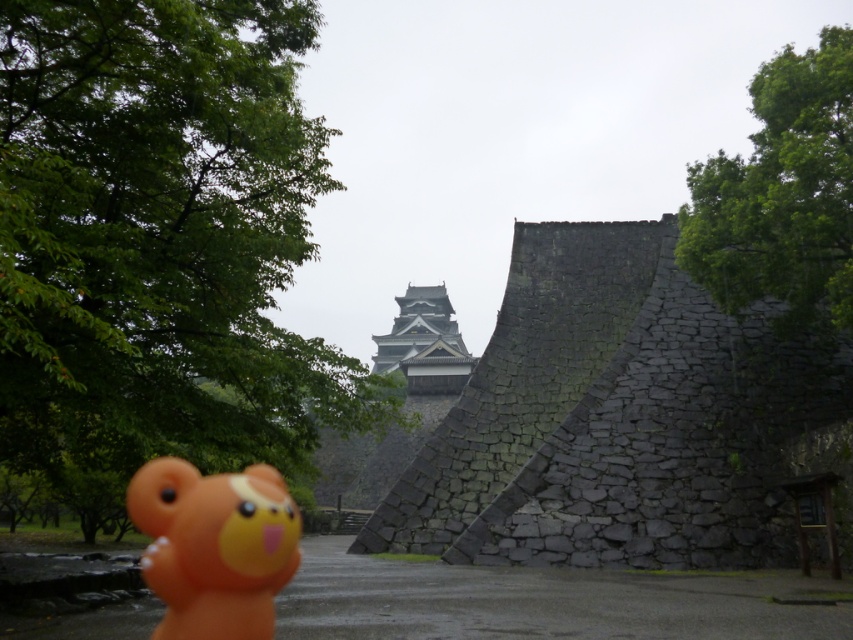
You are a visitor at Kumamoto Castle and want to take a photo of the dark gray stone wall at center and the orange rubber bear at lower left. Which object appears wider in the photo?

The dark gray stone wall at center appears wider in the photo because its width surpasses that of the orange rubber bear at lower left.

You are a visitor at Kumamoto Castle and notice the dark gray stone wall at center and the orange rubber bear at lower left. Which object is located to the right of the other?

The dark gray stone wall at center is positioned on the right side of orange rubber bear at lower left.